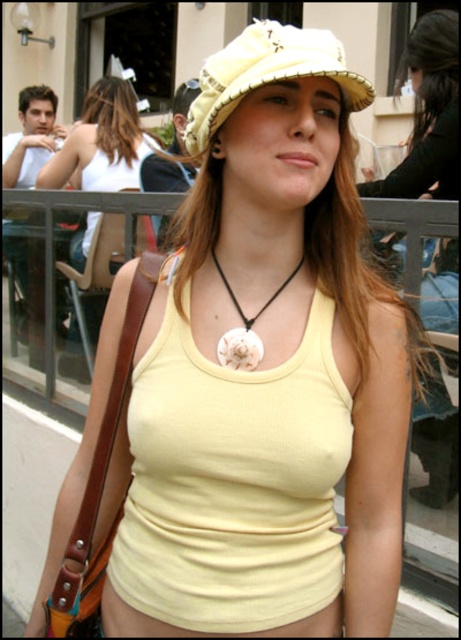
What object is located at the coordinates point [266,74] in the image?

The beige straw hat at center is located at point [266,74].

You are a fashion designer observing a person wearing a matte yellow tank top at center and a white shell necklace at center. Which clothing item is positioned to the left?

The matte yellow tank top at center is positioned on the left side of the white shell necklace at center.

Based on the photo, the beige straw hat at center is located at which coordinate point?

The beige straw hat at center is located at point (x=266, y=74).